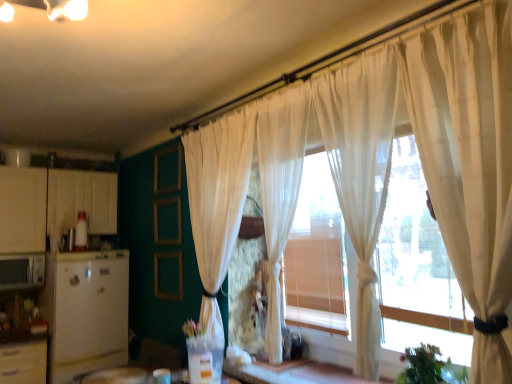
This screenshot has height=384, width=512. What do you see at coordinates (52, 204) in the screenshot?
I see `white matte cabinet at left` at bounding box center [52, 204].

What do you see at coordinates (22, 271) in the screenshot?
I see `matte white microwave at left, which is the second appliance in right-to-left order` at bounding box center [22, 271].

Describe the element at coordinates (416, 266) in the screenshot. I see `translucent wood window frame at center` at that location.

Where is `white matte refrigerator at left, which appears as the first appliance when viewed from the right`? white matte refrigerator at left, which appears as the first appliance when viewed from the right is located at coordinates (86, 311).

You are a GUI agent. You are given a task and a screenshot of the screen. Output one action in this format:
    pyautogui.click(x=<x>, y=<y>)
    Task: Click on the sheer white curtain at center, the third curtain in the left-to-right sequence
    This screenshot has height=384, width=512.
    Given the screenshot: What is the action you would take?
    pyautogui.click(x=361, y=173)

What do you see at coordinates (361, 173) in the screenshot? The width and height of the screenshot is (512, 384). I see `sheer white curtain at center, which appears as the second curtain when viewed from the right` at bounding box center [361, 173].

The image size is (512, 384). I want to click on sheer white curtain at center, which appears as the 2th curtain when viewed from the left, so click(x=280, y=189).

Image resolution: width=512 pixels, height=384 pixels. I want to click on white matte cabinet at left, so click(x=52, y=204).

Can you confirm if white matte refrigerator at left, positioned as the second appliance in left-to-right order, is taller than sheer white curtain at center, which is the fourth curtain in right-to-left order?

No.

Is white matte refrigerator at left, positioned as the second appliance in left-to-right order, completely or partially outside of sheer white curtain at center, the first curtain in the left-to-right sequence?

Yes.

In the image, is white matte refrigerator at left, positioned as the second appliance in left-to-right order, positioned in front of or behind sheer white curtain at center, the first curtain in the left-to-right sequence?

white matte refrigerator at left, positioned as the second appliance in left-to-right order, is behind sheer white curtain at center, the first curtain in the left-to-right sequence.

Does white matte refrigerator at left, which appears as the first appliance when viewed from the right, have a lesser width compared to sheer white curtain at center, the first curtain in the left-to-right sequence?

No, white matte refrigerator at left, which appears as the first appliance when viewed from the right, is not thinner than sheer white curtain at center, the first curtain in the left-to-right sequence.

Considering the sizes of objects white matte refrigerator at left, positioned as the second appliance in left-to-right order, and sheer white curtain at center, arranged as the 3th curtain when viewed from the right, in the image provided, who is shorter, white matte refrigerator at left, positioned as the second appliance in left-to-right order, or sheer white curtain at center, arranged as the 3th curtain when viewed from the right,?

white matte refrigerator at left, positioned as the second appliance in left-to-right order.

Between white matte refrigerator at left, which appears as the first appliance when viewed from the right, and sheer white curtain at center, arranged as the 3th curtain when viewed from the right, which one has larger size?

white matte refrigerator at left, which appears as the first appliance when viewed from the right.

From the image's perspective, relative to sheer white curtain at center, which appears as the 2th curtain when viewed from the left, is white matte refrigerator at left, positioned as the second appliance in left-to-right order, above or below?

From the image's perspective, white matte refrigerator at left, positioned as the second appliance in left-to-right order, appears below sheer white curtain at center, which appears as the 2th curtain when viewed from the left.

Which is less distant, (127, 355) or (292, 217)?

Clearly, point (127, 355) is more distant from the camera than point (292, 217).

Between sheer white curtain at right, which ranks as the first curtain in right-to-left order, and green leafy plant at lower right, which one has smaller size?

With smaller size is green leafy plant at lower right.

Are sheer white curtain at right, placed as the 4th curtain when sorted from left to right, and green leafy plant at lower right making contact?

They are not placed beside each other.

Could you tell me if sheer white curtain at right, placed as the 4th curtain when sorted from left to right, is turned towards green leafy plant at lower right?

No, sheer white curtain at right, placed as the 4th curtain when sorted from left to right, does not turn towards green leafy plant at lower right.

Can you confirm if sheer white curtain at right, which ranks as the first curtain in right-to-left order, is positioned to the right of green leafy plant at lower right?

No.

Does point (95, 336) come behind point (499, 220)?

Yes.

Is white matte refrigerator at left, which appears as the first appliance when viewed from the right, to the right of sheer white curtain at right, which ranks as the first curtain in right-to-left order, from the viewer's perspective?

No, white matte refrigerator at left, which appears as the first appliance when viewed from the right, is not to the right of sheer white curtain at right, which ranks as the first curtain in right-to-left order.

Is white matte refrigerator at left, positioned as the second appliance in left-to-right order, outside of sheer white curtain at right, placed as the 4th curtain when sorted from left to right?

Yes, white matte refrigerator at left, positioned as the second appliance in left-to-right order, is located beyond the bounds of sheer white curtain at right, placed as the 4th curtain when sorted from left to right.

From a real-world perspective, is white matte refrigerator at left, which appears as the first appliance when viewed from the right, on top of sheer white curtain at right, placed as the 4th curtain when sorted from left to right?

No, from a real-world perspective, white matte refrigerator at left, which appears as the first appliance when viewed from the right, is not on top of sheer white curtain at right, placed as the 4th curtain when sorted from left to right.

Looking at this image, does matte white microwave at left, which is the second appliance in right-to-left order, have a larger size compared to white matte refrigerator at left, which appears as the first appliance when viewed from the right?

No, matte white microwave at left, which is the second appliance in right-to-left order, is not bigger than white matte refrigerator at left, which appears as the first appliance when viewed from the right.

Between point (31, 258) and point (70, 300), which one is positioned in front?

Positioned in front is point (70, 300).

In the image, is matte white microwave at left, which is the second appliance in right-to-left order, positioned in front of or behind white matte refrigerator at left, which appears as the first appliance when viewed from the right?

Clearly, matte white microwave at left, which is the second appliance in right-to-left order, is behind white matte refrigerator at left, which appears as the first appliance when viewed from the right.

Image resolution: width=512 pixels, height=384 pixels. In order to click on appliance above the white matte refrigerator at left, positioned as the second appliance in left-to-right order (from a real-world perspective) in this screenshot , I will do `click(22, 271)`.

Is white matte cabinet at left bigger or smaller than sheer white curtain at center, which appears as the second curtain when viewed from the right?

Clearly, white matte cabinet at left is larger in size than sheer white curtain at center, which appears as the second curtain when viewed from the right.

From the image's perspective, is white matte cabinet at left above or below sheer white curtain at center, which appears as the second curtain when viewed from the right?

white matte cabinet at left is below sheer white curtain at center, which appears as the second curtain when viewed from the right.

Are white matte cabinet at left and sheer white curtain at center, the third curtain in the left-to-right sequence, far apart?

Yes, white matte cabinet at left and sheer white curtain at center, the third curtain in the left-to-right sequence, are quite far apart.

Is point (24, 206) farther from viewer compared to point (360, 73)?

Yes, point (24, 206) is behind point (360, 73).

Considering the positions of objects matte white microwave at left, which is the second appliance in right-to-left order, and sheer white curtain at right, which ranks as the first curtain in right-to-left order, in the image provided, who is behind, matte white microwave at left, which is the second appliance in right-to-left order, or sheer white curtain at right, which ranks as the first curtain in right-to-left order,?

matte white microwave at left, which is the second appliance in right-to-left order, is further away from the camera.

Considering the sizes of objects matte white microwave at left, the first appliance positioned from the left, and sheer white curtain at right, which ranks as the first curtain in right-to-left order, in the image provided, who is taller, matte white microwave at left, the first appliance positioned from the left, or sheer white curtain at right, which ranks as the first curtain in right-to-left order,?

→ With more height is sheer white curtain at right, which ranks as the first curtain in right-to-left order.

Does matte white microwave at left, which is the second appliance in right-to-left order, have a larger size compared to sheer white curtain at right, which ranks as the first curtain in right-to-left order?

No.

From the image's perspective, which appliance is the 2nd one below the sheer white curtain at center, which is the fourth curtain in right-to-left order? Please provide its 2D coordinates.

[(86, 311)]

Identify the location of the 2nd curtain positioned above the white matte refrigerator at left, positioned as the second appliance in left-to-right order (from the image's perspective). This screenshot has width=512, height=384. (280, 189).

Based on their spatial positions, is white matte cabinet at left or matte white microwave at left, the first appliance positioned from the left, further from sheer white curtain at right, placed as the 4th curtain when sorted from left to right?

matte white microwave at left, the first appliance positioned from the left, is further to sheer white curtain at right, placed as the 4th curtain when sorted from left to right.

From the image, which object appears to be nearer to green leafy plant at lower right, sheer white curtain at right, which ranks as the first curtain in right-to-left order, or sheer white curtain at center, the first curtain in the left-to-right sequence?

sheer white curtain at right, which ranks as the first curtain in right-to-left order, lies closer to green leafy plant at lower right than the other object.

When comparing their distances from translucent wood window frame at center, does green leafy plant at lower right or white matte cabinet at left seem further?

white matte cabinet at left is further to translucent wood window frame at center.

When comparing their distances from sheer white curtain at right, placed as the 4th curtain when sorted from left to right, does sheer white curtain at center, the first curtain in the left-to-right sequence, or white matte refrigerator at left, which appears as the first appliance when viewed from the right, seem further?

Among the two, white matte refrigerator at left, which appears as the first appliance when viewed from the right, is located further to sheer white curtain at right, placed as the 4th curtain when sorted from left to right.

Which object lies nearer to the anchor point white matte refrigerator at left, positioned as the second appliance in left-to-right order, sheer white curtain at right, which ranks as the first curtain in right-to-left order, or sheer white curtain at center, the third curtain in the left-to-right sequence?

Among the two, sheer white curtain at center, the third curtain in the left-to-right sequence, is located nearer to white matte refrigerator at left, positioned as the second appliance in left-to-right order.

Looking at the image, which one is located closer to sheer white curtain at center, arranged as the 3th curtain when viewed from the right, translucent wood window frame at center or white matte cabinet at left?

Based on the image, translucent wood window frame at center appears to be nearer to sheer white curtain at center, arranged as the 3th curtain when viewed from the right.

Looking at the image, which one is located further to translucent wood window frame at center, green leafy plant at lower right or sheer white curtain at right, which ranks as the first curtain in right-to-left order?

sheer white curtain at right, which ranks as the first curtain in right-to-left order, lies further to translucent wood window frame at center than the other object.

When comparing their distances from sheer white curtain at center, which appears as the second curtain when viewed from the right, does matte white microwave at left, the first appliance positioned from the left, or sheer white curtain at center, arranged as the 3th curtain when viewed from the right, seem further?

The object further to sheer white curtain at center, which appears as the second curtain when viewed from the right, is matte white microwave at left, the first appliance positioned from the left.

Locate an element on the screen. Image resolution: width=512 pixels, height=384 pixels. cabinetry between matte white microwave at left, the first appliance positioned from the left, and sheer white curtain at right, placed as the 4th curtain when sorted from left to right, in the horizontal direction is located at coordinates (52, 204).

Locate an element on the screen. curtain situated between white matte refrigerator at left, positioned as the second appliance in left-to-right order, and sheer white curtain at center, which appears as the 2th curtain when viewed from the left, from left to right is located at coordinates (246, 187).

Find the location of `window frame between matte white microwave at left, which is the second appliance in right-to-left order, and green leafy plant at lower right from left to right`. window frame between matte white microwave at left, which is the second appliance in right-to-left order, and green leafy plant at lower right from left to right is located at coordinates (416, 266).

The image size is (512, 384). I want to click on appliance located between matte white microwave at left, which is the second appliance in right-to-left order, and sheer white curtain at right, placed as the 4th curtain when sorted from left to right, in the left-right direction, so click(86, 311).